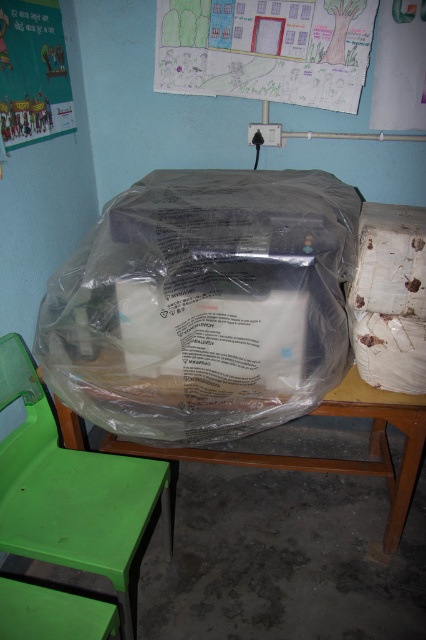
You are a teacher organizing the classroom. You need to decide where to place a new desk that requires 1.2 meters of vertical space. Given the green plastic chair at lower left and the matte paper poster at upper left, which object would limit the available vertical space for the desk?

The green plastic chair at lower left is taller than the matte paper poster at upper left, so the green plastic chair at lower left would limit the available vertical space for the desk since it is taller.

You are standing in the classroom and need to place a new poster on the wall. The poster requires a space that is 1 meter wide. Is there enough space on the wall above the wooden table at center to accommodate the poster?

The wooden table at center is positioned at point (334, 458). However, the exact dimensions of the wall space above it are not provided in the scene description. Therefore, it is impossible to determine if the space is wide enough for the 1 meter poster.

You are standing at the center of the classroom and need to move to the green plastic chair at lower left. Based on the coordinates provided, in which direction should you move first?

The green plastic chair at lower left is located at coordinates point (71, 490). Since you are at the center, you should move downward and to the right to reach it.